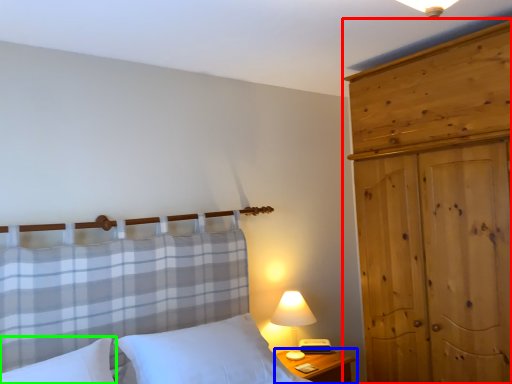
Question: Estimate the real-world distances between objects in this image. Which object is farther from dresser (highlighted by a red box), nightstand (highlighted by a blue box) or pillow (highlighted by a green box)?

Choices:
 (A) nightstand
 (B) pillow

Answer: (B)